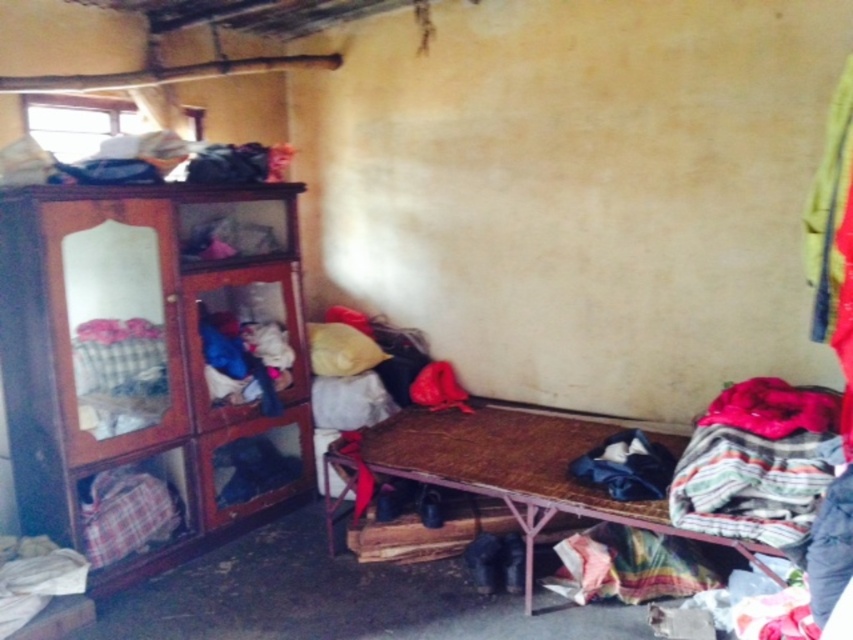
You are standing in the room and want to place a 36 inch long decorative bench between the wooden wardrobe at left and the rustic wooden bed at lower right. Is there enough space to fit the bench without moving either object?

The wooden wardrobe at left is 36.55 inches away from rustic wooden bed at lower right. Since the bench is 36 inches long, it can fit between them with a small amount of space remaining.

Looking at this image, you are standing in the center of the room and want to place a new rug. The wooden wardrobe at left is at coordinates 0.575, 0.171. Where should you place the rug to ensure it is centered between the wardrobe and the opposite wall?

To center the rug between the wooden wardrobe at left and the opposite wall, place it along the line perpendicular to the wardrobe at a distance halfway between the wardrobe and the wall. Since the wardrobe is at coordinates (x=144, y=368), calculate the midpoint between this point and the wall to determine the rug placement.

You are trying to decide whether to place a tall floor lamp in this room. Given the wooden wardrobe at left and the rustic wooden bed at lower right, which object would be better suited to place the lamp next to, considering their heights?

The wooden wardrobe at left is much taller than the rustic wooden bed at lower right, so placing the tall floor lamp next to the wooden wardrobe at left would be more appropriate as it can better accommodate the lamp without it appearing disproportionate.